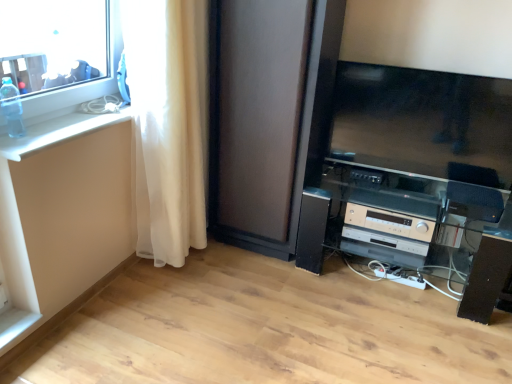
Question: Considering the relative sizes of white glossy counter top at left and transparent plastic bottle at upper left in the image provided, is white glossy counter top at left wider than transparent plastic bottle at upper left?

Choices:
 (A) no
 (B) yes

Answer: (B)

Question: From a real-world perspective, does white glossy counter top at left sit lower than transparent plastic bottle at upper left?

Choices:
 (A) no
 (B) yes

Answer: (B)

Question: Is transparent plastic bottle at upper left located within white glossy counter top at left?

Choices:
 (A) yes
 (B) no

Answer: (B)

Question: Is white glossy counter top at left closer to camera compared to transparent plastic bottle at upper left?

Choices:
 (A) yes
 (B) no

Answer: (A)

Question: Is white glossy counter top at left further to the viewer compared to transparent plastic bottle at upper left?

Choices:
 (A) no
 (B) yes

Answer: (A)

Question: From their relative heights in the image, would you say white sheer curtain at left is taller or shorter than satin black entertainment center at lower right?

Choices:
 (A) short
 (B) tall

Answer: (B)

Question: From the image's perspective, is white sheer curtain at left above or below satin black entertainment center at lower right?

Choices:
 (A) below
 (B) above

Answer: (B)

Question: From a real-world perspective, is white sheer curtain at left positioned above or below satin black entertainment center at lower right?

Choices:
 (A) above
 (B) below

Answer: (A)

Question: Relative to satin black entertainment center at lower right, is white sheer curtain at left in front or behind?

Choices:
 (A) behind
 (B) front

Answer: (B)

Question: Looking at their shapes, would you say transparent glass window at upper left is wider or thinner than matte black screen door at center?

Choices:
 (A) wide
 (B) thin

Answer: (B)

Question: Considering the relative positions of transparent glass window at upper left and matte black screen door at center in the image provided, is transparent glass window at upper left to the left or to the right of matte black screen door at center?

Choices:
 (A) left
 (B) right

Answer: (A)

Question: Is transparent glass window at upper left bigger or smaller than matte black screen door at center?

Choices:
 (A) big
 (B) small

Answer: (B)

Question: In the image, is transparent glass window at upper left positioned in front of or behind matte black screen door at center?

Choices:
 (A) behind
 (B) front

Answer: (B)

Question: Considering the positions of transparent plastic bottle at upper left and satin black entertainment center at lower right in the image, is transparent plastic bottle at upper left taller or shorter than satin black entertainment center at lower right?

Choices:
 (A) short
 (B) tall

Answer: (A)

Question: From a real-world perspective, is transparent plastic bottle at upper left physically located above or below satin black entertainment center at lower right?

Choices:
 (A) below
 (B) above

Answer: (B)